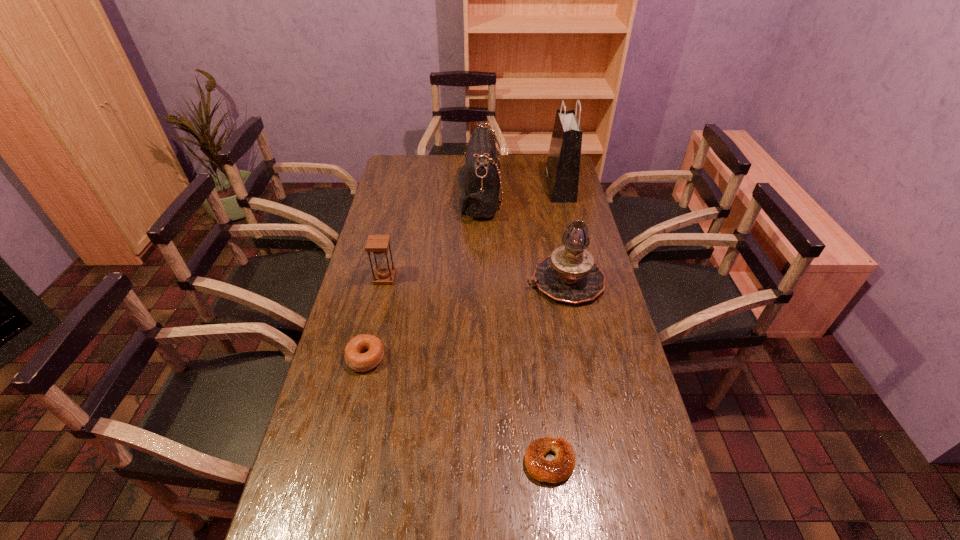
Identify the location of shopping bag. The width and height of the screenshot is (960, 540). (562, 169).

Identify the location of the fourth object from right to left. (480, 189).

This screenshot has width=960, height=540. I want to click on oil lamp, so click(x=569, y=274).

Where is `the fourth tallest object`? The height and width of the screenshot is (540, 960). the fourth tallest object is located at coordinates (378, 244).

The width and height of the screenshot is (960, 540). I want to click on the taller bagel, so click(358, 361).

Find the location of a particular element. This screenshot has width=960, height=540. the second shortest object is located at coordinates (358, 361).

You are a GUI agent. You are given a task and a screenshot of the screen. Output one action in this format:
    pyautogui.click(x=<x>, y=<y>)
    Task: Click on the shorter bagel
    
    Given the screenshot: What is the action you would take?
    pyautogui.click(x=560, y=468)

The image size is (960, 540). Find the location of `the nearest object`. the nearest object is located at coordinates (560, 468).

Find the location of a particular element. This screenshot has width=960, height=540. vacant space situated 0.080m on the front with handles of the tallest object is located at coordinates (530, 187).

Locate an element on the screen. This screenshot has height=540, width=960. vacant region located on the front with handles of the tallest object is located at coordinates (506, 187).